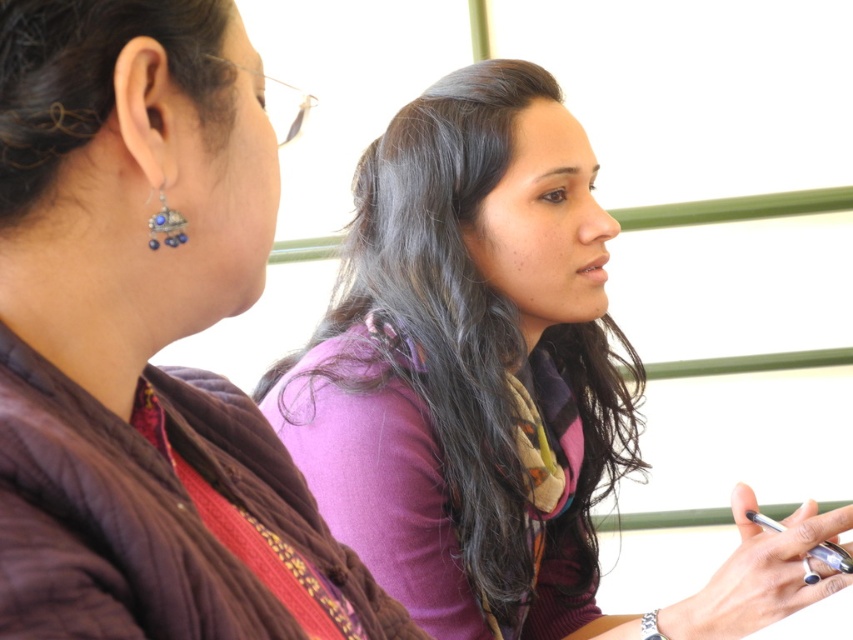
Does brown fabric scarf at upper center lie behind purple soft scarf at center?

No.

Based on the photo, between brown fabric scarf at upper center and purple soft scarf at center, which one appears on the right side from the viewer's perspective?

From the viewer's perspective, purple soft scarf at center appears more on the right side.

Is point (74, 518) closer to camera compared to point (566, 284)?

Yes, it is.

I want to click on brown fabric scarf at upper center, so click(144, 340).

Can you confirm if purple soft scarf at center is taller than sapphire-studded silver earring at left?

Yes.

Is purple soft scarf at center shorter than sapphire-studded silver earring at left?

No, purple soft scarf at center is not shorter than sapphire-studded silver earring at left.

Does point (404, 284) lie behind point (169, 216)?

Yes, point (404, 284) is behind point (169, 216).

The height and width of the screenshot is (640, 853). In order to click on purple soft scarf at center in this screenshot , I will do `click(494, 384)`.

Is brown fabric scarf at upper center wider than sapphire-studded silver earring at left?

Indeed, brown fabric scarf at upper center has a greater width compared to sapphire-studded silver earring at left.

Is brown fabric scarf at upper center below sapphire-studded silver earring at left?

Correct, brown fabric scarf at upper center is located below sapphire-studded silver earring at left.

Find the location of a particular element. brown fabric scarf at upper center is located at coordinates (144, 340).